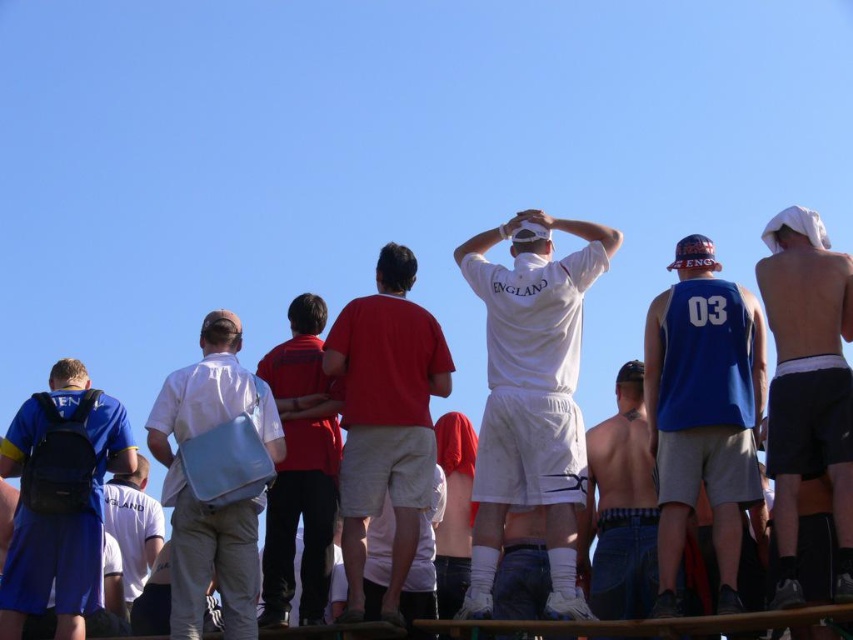
What is the object located at the coordinates point (531, 396)?

The point (531, 396) marks the white matte shirt at center.

You are a photographer trying to capture a photo of the white matte shirt at center and the blue fabric backpack at left. Which object should you zoom in on to ensure both are clearly visible in the frame?

The white matte shirt at center is bigger than the blue fabric backpack at left. To ensure both are clearly visible, you should zoom in on the smaller object, the blue fabric backpack at left, so the larger shirt doesn

You are a photographer trying to capture both the white matte shirt at center and the white cotton shirt at center in a single shot. Which shirt should you focus on first to ensure both are in frame?

The white matte shirt at center is above the white cotton shirt at center, so focusing on the white matte shirt at center first will ensure both shirts are captured in the frame.